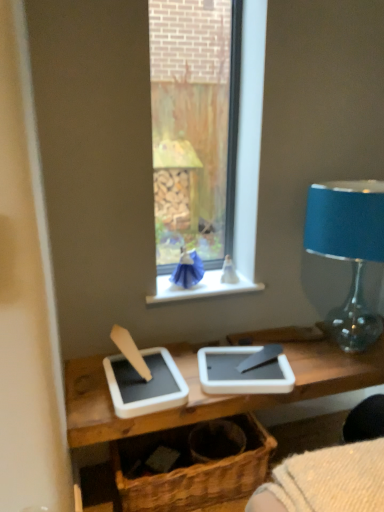
Question: Is brown woven basket at center further to camera compared to blue glass lampshade at right?

Choices:
 (A) no
 (B) yes

Answer: (B)

Question: Is brown woven basket at center at the right side of blue glass lampshade at right?

Choices:
 (A) no
 (B) yes

Answer: (A)

Question: Could you tell me if brown woven basket at center is turned towards blue glass lampshade at right?

Choices:
 (A) yes
 (B) no

Answer: (B)

Question: Considering the relative positions of brown woven basket at center and blue glass lampshade at right in the image provided, is brown woven basket at center to the left of blue glass lampshade at right from the viewer's perspective?

Choices:
 (A) no
 (B) yes

Answer: (B)

Question: From a real-world perspective, is brown woven basket at center below blue glass lampshade at right?

Choices:
 (A) yes
 (B) no

Answer: (A)

Question: From a real-world perspective, is blue glass lampshade at right positioned above or below white plastic window sill at center?

Choices:
 (A) above
 (B) below

Answer: (A)

Question: Is point (337, 327) closer or farther from the camera than point (170, 289)?

Choices:
 (A) closer
 (B) farther

Answer: (B)

Question: From the image's perspective, relative to white plastic window sill at center, is blue glass lampshade at right above or below?

Choices:
 (A) above
 (B) below

Answer: (A)

Question: Is blue glass lampshade at right wider or thinner than white plastic window sill at center?

Choices:
 (A) thin
 (B) wide

Answer: (B)

Question: Relative to brown woven basket at center, is blue glass lampshade at right in front or behind?

Choices:
 (A) behind
 (B) front

Answer: (B)

Question: Does point pyautogui.click(x=357, y=227) appear closer or farther from the camera than point pyautogui.click(x=155, y=433)?

Choices:
 (A) closer
 (B) farther

Answer: (A)

Question: From their relative heights in the image, would you say blue glass lampshade at right is taller or shorter than brown woven basket at center?

Choices:
 (A) short
 (B) tall

Answer: (B)

Question: From a real-world perspective, is blue glass lampshade at right above or below brown woven basket at center?

Choices:
 (A) below
 (B) above

Answer: (B)

Question: Is white plastic window sill at center wider or thinner than brown woven basket at center?

Choices:
 (A) thin
 (B) wide

Answer: (A)

Question: Which is correct: white plastic window sill at center is inside brown woven basket at center, or outside of it?

Choices:
 (A) inside
 (B) outside

Answer: (B)